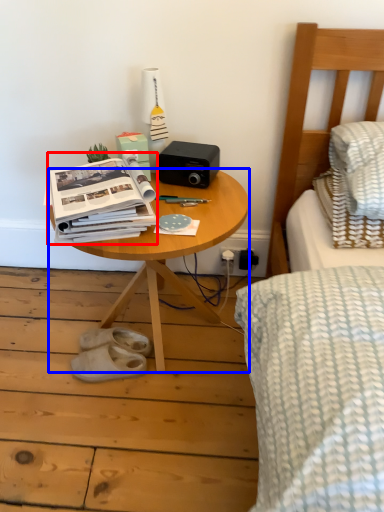
Question: Among these objects, which one is farthest to the camera, paperback book (highlighted by a red box) or table (highlighted by a blue box)?

Choices:
 (A) paperback book
 (B) table

Answer: (B)